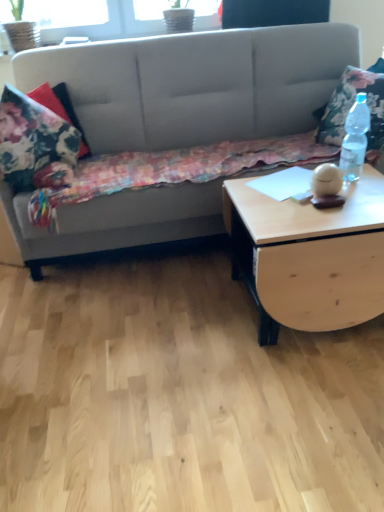
Question: From a real-world perspective, relative to suede gray couch at upper left, is floral fabric pillow at right vertically above or below?

Choices:
 (A) below
 (B) above

Answer: (B)

Question: Does point (372, 120) appear closer or farther from the camera than point (180, 46)?

Choices:
 (A) closer
 (B) farther

Answer: (A)

Question: Considering the real-world distances, which object is farthest from the light wood/texture coffee table at right?

Choices:
 (A) floral fabric blanket at left
 (B) clear plastic bottle at right
 (C) floral fabric pillow at right
 (D) floral fabric pillow at left
 (E) suede gray couch at upper left

Answer: (D)

Question: Which is farther from the clear plastic bottle at right?

Choices:
 (A) floral fabric pillow at right
 (B) floral fabric pillow at left
 (C) floral fabric blanket at left
 (D) suede gray couch at upper left
 (E) light wood/texture coffee table at right

Answer: (B)